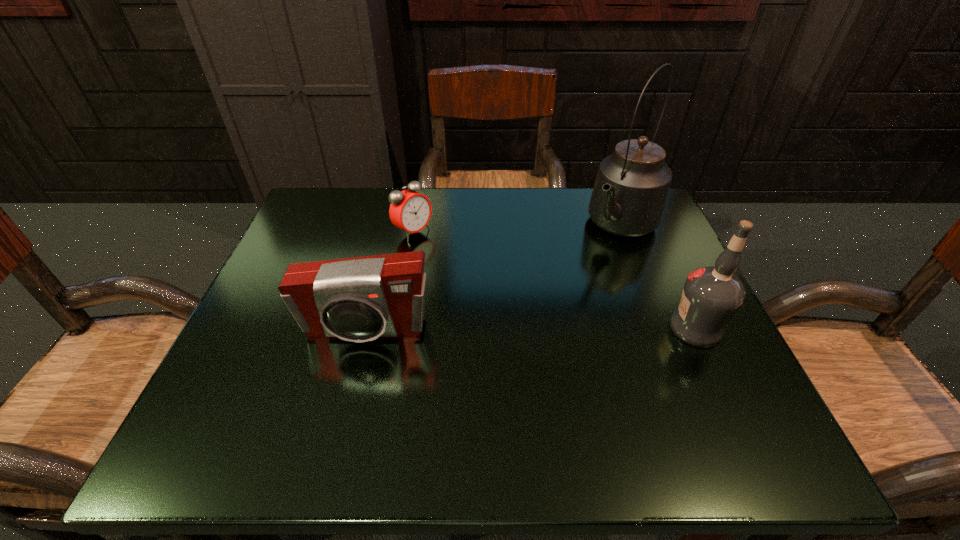
You are a GUI agent. You are given a task and a screenshot of the screen. Output one action in this format:
    pyautogui.click(x=<x>, y=<y>)
    Task: Click on the free space at the far edge
    The width and height of the screenshot is (960, 540).
    Given the screenshot: What is the action you would take?
    pyautogui.click(x=442, y=224)

This screenshot has height=540, width=960. In the image, there is a desktop. In order to click on free region at the left edge in this screenshot , I will do `click(273, 284)`.

Identify the location of blank area at the right edge. (653, 312).

The height and width of the screenshot is (540, 960). In the image, there is a desktop. In order to click on free space at the far left corner in this screenshot , I will do `click(305, 219)`.

The height and width of the screenshot is (540, 960). In order to click on vacant space at the near right corner in this screenshot , I will do `click(686, 374)`.

Locate an element on the screen. The height and width of the screenshot is (540, 960). free space between the kettle and the alarm clock is located at coordinates (516, 230).

This screenshot has width=960, height=540. In order to click on vacant area that lies between the vodka and the shortest object in this screenshot , I will do `click(555, 280)`.

This screenshot has height=540, width=960. I want to click on free area in between the vodka and the alarm clock, so click(555, 280).

This screenshot has width=960, height=540. What are the coordinates of `vacant space in between the second shortest object and the vodka` in the screenshot? It's located at (530, 329).

Identify the location of free spot between the third shortest object and the camera. The image size is (960, 540). (530, 329).